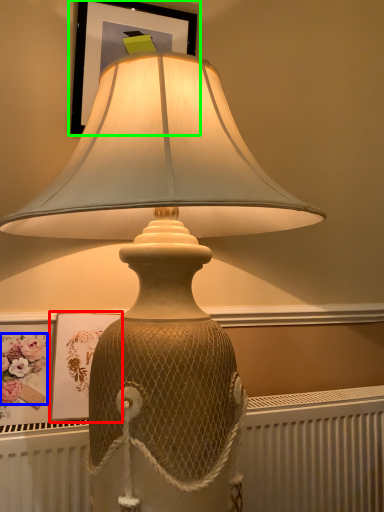
Question: Considering the real-world distances, which object is farthest from picture frame (highlighted by a red box)? flower (highlighted by a blue box) or picture frame (highlighted by a green box)?

Choices:
 (A) flower
 (B) picture frame

Answer: (B)